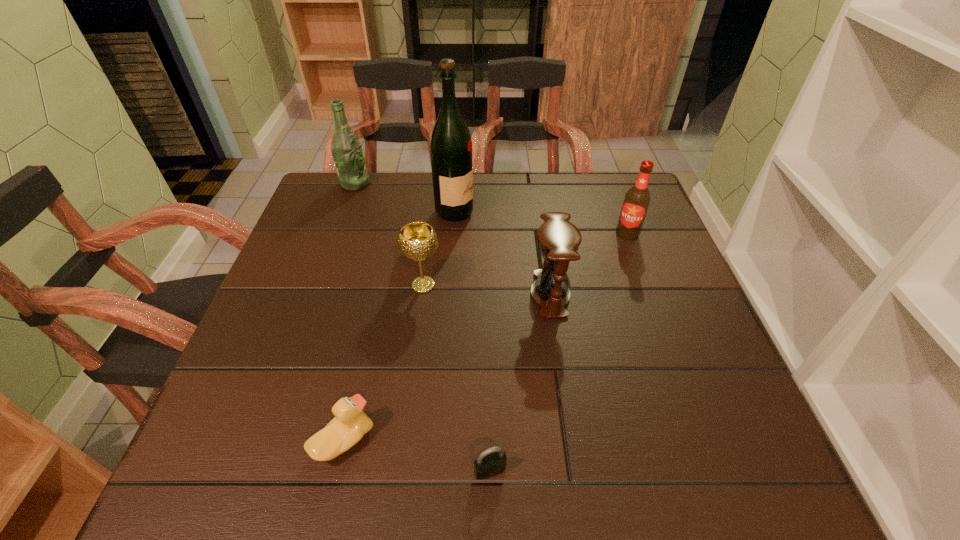
Find the location of a particular element. Image resolution: width=960 pixels, height=540 pixels. the shortest object is located at coordinates (492, 461).

Where is `the third object from right to left`? This screenshot has width=960, height=540. the third object from right to left is located at coordinates (492, 461).

What are the coordinates of `blank space located on the front-facing side of the tallest object` in the screenshot? It's located at (520, 212).

Find the location of a particular element. The width and height of the screenshot is (960, 540). vacant space positioned on the surface of the leftmost object is located at coordinates (420, 184).

At what (x,y) coordinates should I click in order to perform the action: click on vacant space located on the back of the right beer bottle. Please return your answer as a coordinate pair (x, y). The image size is (960, 540). Looking at the image, I should click on pyautogui.click(x=609, y=183).

Where is `vacant region located on the left of the hourglass`? The image size is (960, 540). vacant region located on the left of the hourglass is located at coordinates (368, 294).

The image size is (960, 540). I want to click on vacant space located 0.190m on the left of the chalice, so click(x=323, y=285).

The width and height of the screenshot is (960, 540). I want to click on blank area located 0.100m at the beak of the second shortest object, so click(431, 441).

You are a GUI agent. You are given a task and a screenshot of the screen. Output one action in this format:
    pyautogui.click(x=<x>, y=<y>)
    Task: Click on the vacant area situated on the left of the fifth object from left to right
    
    Given the screenshot: What is the action you would take?
    pyautogui.click(x=413, y=471)

The height and width of the screenshot is (540, 960). Identify the location of liquor present at the far edge. (451, 145).